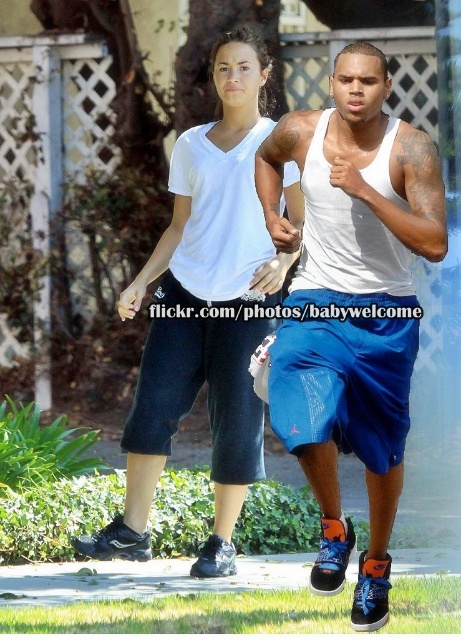
Can you confirm if blue fabric shorts at center is thinner than black synthetic running shoe at lower left?

Incorrect, blue fabric shorts at center's width is not less than black synthetic running shoe at lower left's.

Which is in front, point (347, 404) or point (108, 524)?

Point (347, 404) is in front.

Between point (270, 372) and point (107, 540), which one is positioned behind?

Point (107, 540)

Image resolution: width=461 pixels, height=640 pixels. Identify the location of blue fabric shorts at center. (344, 372).